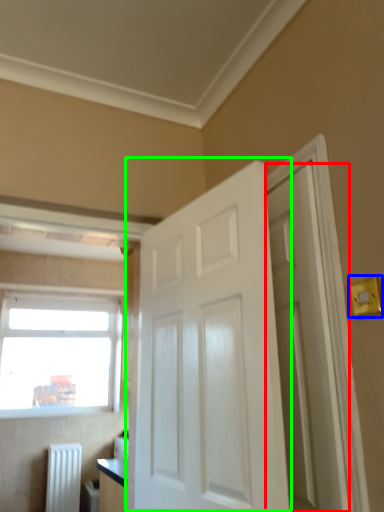
Question: Which object is positioned farthest from door (highlighted by a red box)? Select from light switch (highlighted by a blue box) and door (highlighted by a green box).

Choices:
 (A) light switch
 (B) door

Answer: (A)